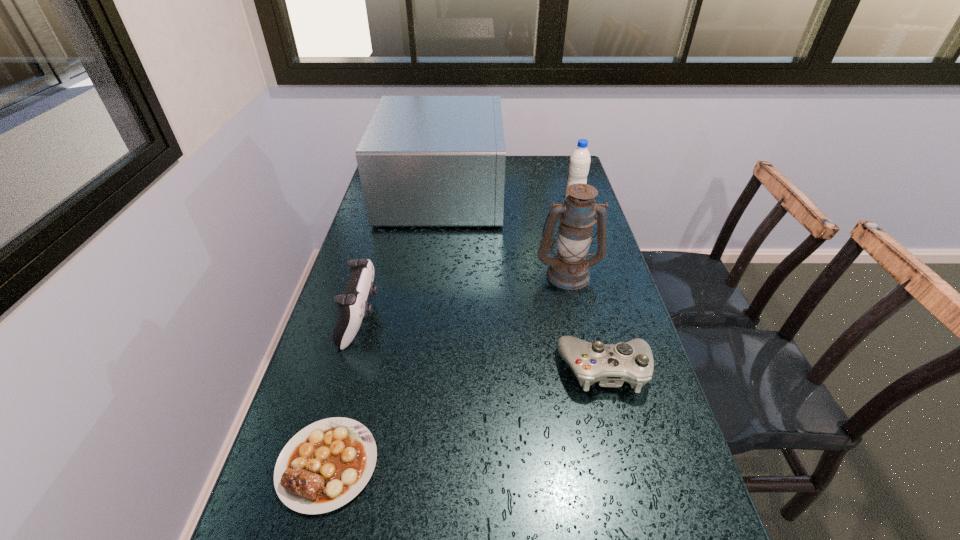
Find the location of a particular element. The image size is (960, 540). oil lamp is located at coordinates (569, 270).

The height and width of the screenshot is (540, 960). I want to click on microwave oven, so click(423, 160).

Identify the location of water bottle. The height and width of the screenshot is (540, 960). (579, 164).

The width and height of the screenshot is (960, 540). Find the location of `the fourth tallest object`. the fourth tallest object is located at coordinates (353, 306).

At what (x,y) coordinates should I click in order to perform the action: click on the left control. Please return your answer as a coordinate pair (x, y). Image resolution: width=960 pixels, height=540 pixels. Looking at the image, I should click on (353, 306).

The height and width of the screenshot is (540, 960). I want to click on the shorter control, so click(610, 365).

Locate an element on the screen. the right control is located at coordinates (610, 365).

The height and width of the screenshot is (540, 960). Find the location of `steak`. steak is located at coordinates (324, 466).

Locate an element on the screen. The height and width of the screenshot is (540, 960). the shortest object is located at coordinates (324, 466).

At what (x,y) coordinates should I click in order to perform the action: click on vacant space located on the back of the third farthest object. Please return your answer as a coordinate pair (x, y). Looking at the image, I should click on (549, 192).